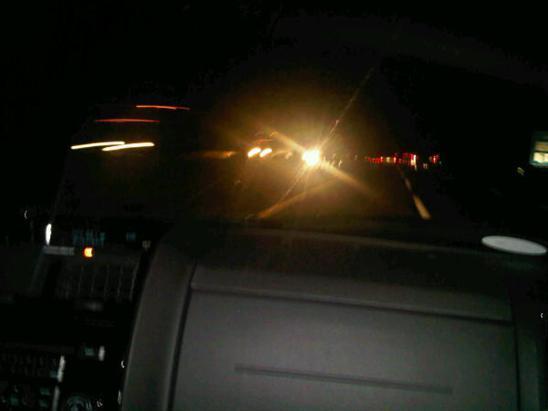
This screenshot has width=548, height=411. I want to click on box, so click(331, 354).